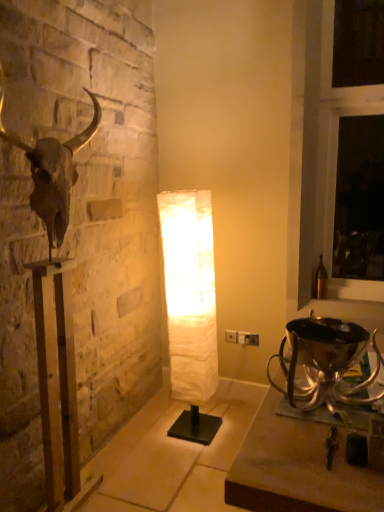
Where is `vacant space situated on the left part of white paper lamp at center`? The height and width of the screenshot is (512, 384). vacant space situated on the left part of white paper lamp at center is located at coordinates (148, 429).